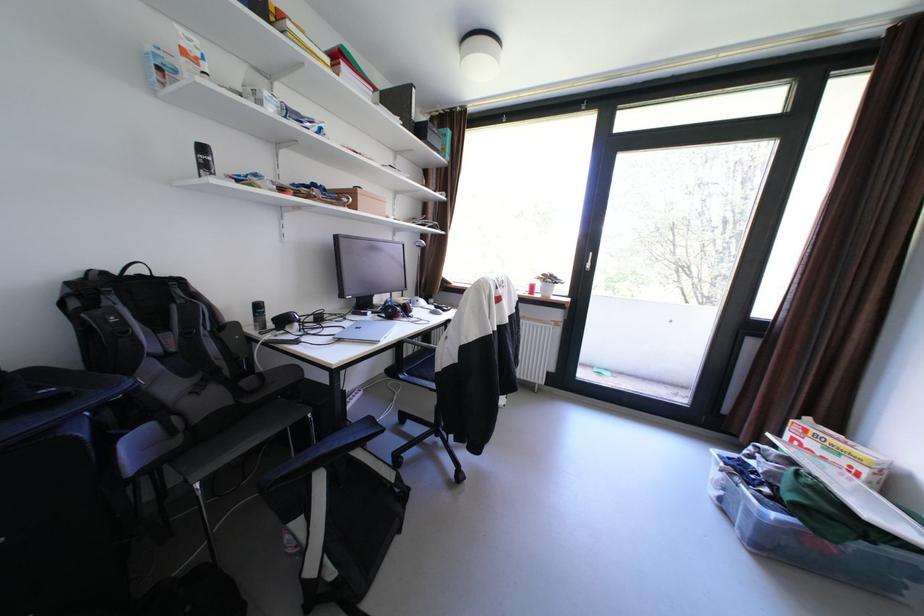
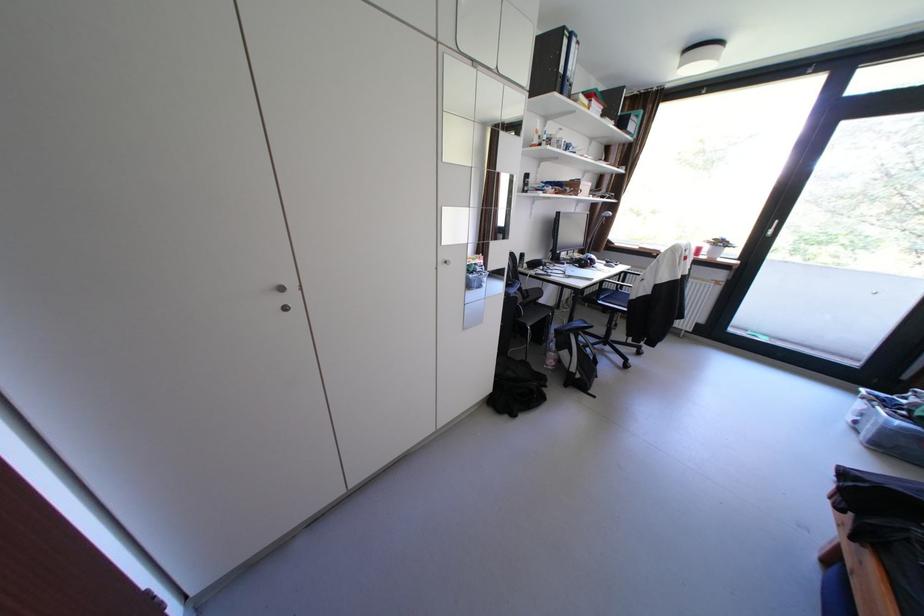
The point at (375, 314) is marked in the first image. Where is the corresponding point in the second image?

(574, 264)